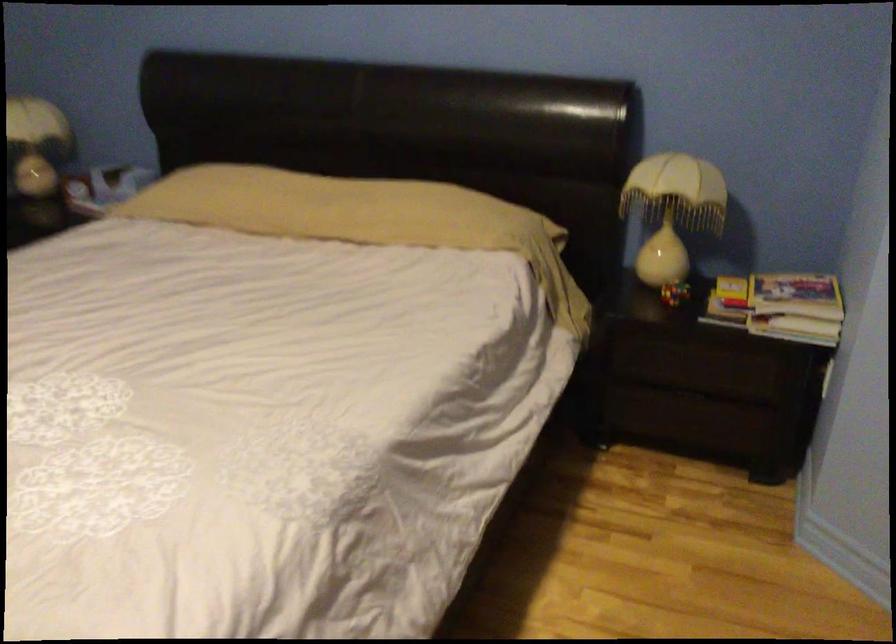
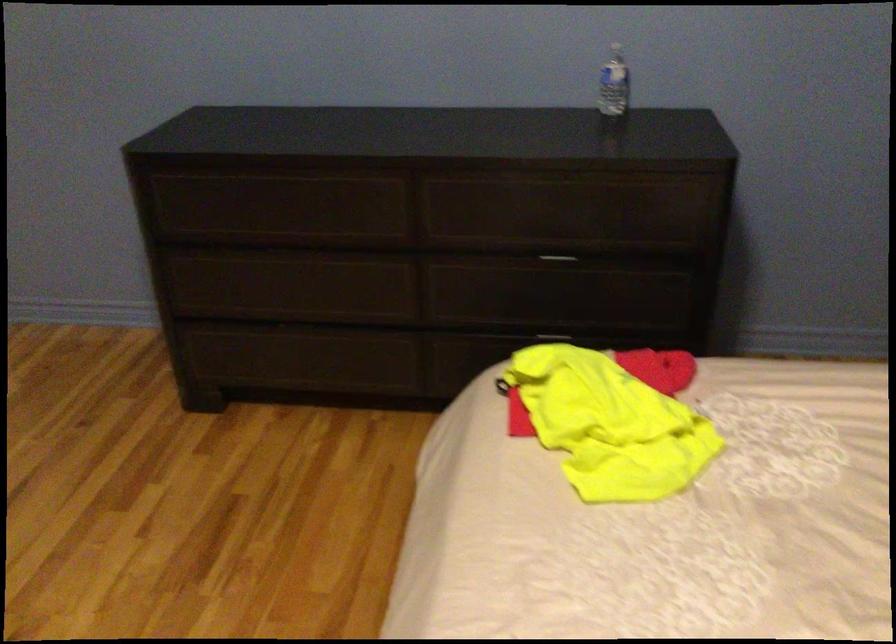
From the picture: The first image is from the beginning of the video and the second image is from the end. How did the camera likely rotate when shooting the video?

The rotation direction of the camera is left-down.